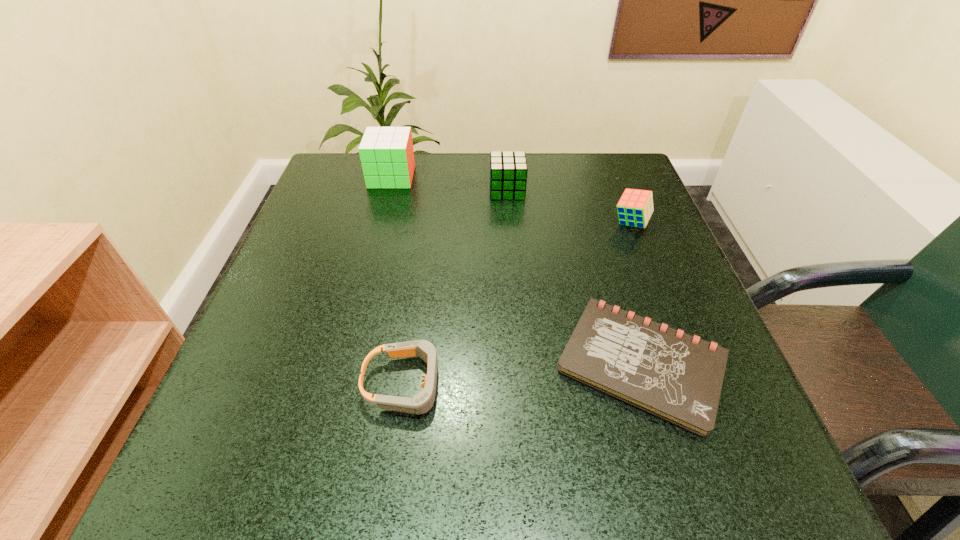
Locate an element on the screen. free space at the left edge is located at coordinates (340, 334).

In the image, there is a desktop. At what (x,y) coordinates should I click in order to perform the action: click on free space at the right edge. Please return your answer as a coordinate pair (x, y). This screenshot has width=960, height=540. Looking at the image, I should click on (661, 305).

This screenshot has height=540, width=960. In order to click on vacant space at the far left corner of the desktop in this screenshot , I will do `click(348, 157)`.

I want to click on vacant area at the far right corner, so click(x=603, y=158).

Identify the location of unoccupied position between the third object from left to right and the tallest cube. This screenshot has height=540, width=960. (449, 184).

This screenshot has width=960, height=540. Identify the location of empty space between the rightmost cube and the second cube from left to right. (569, 206).

Find the location of `vacant area between the notebook and the goggles`. vacant area between the notebook and the goggles is located at coordinates (524, 374).

Find the location of a particular element. unoccupied position between the notebook and the second cube from left to right is located at coordinates (574, 277).

Where is `vacant area that lies between the notebook and the third farthest object`? vacant area that lies between the notebook and the third farthest object is located at coordinates (636, 293).

At what (x,y) coordinates should I click in order to perform the action: click on free space between the rightmost cube and the shortest object. Please return your answer as a coordinate pair (x, y). The image size is (960, 540). Looking at the image, I should click on (636, 293).